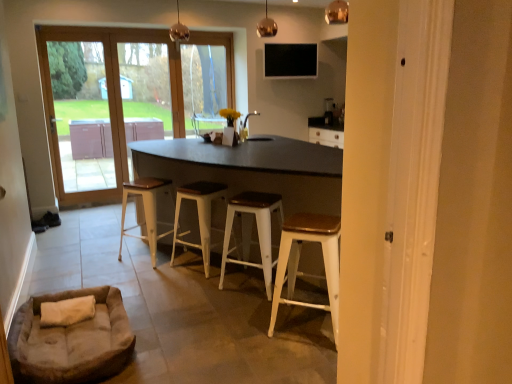
Question: Is wooden seat white metal stool at center, marked as the second stool in a right-to-left arrangement, at the left side of wooden seat white stool at center, the first stool from the left?

Choices:
 (A) yes
 (B) no

Answer: (B)

Question: Does wooden seat white metal stool at center, marked as the third stool in a left-to-right arrangement, have a lesser width compared to wooden seat white stool at center, the 4th stool when ordered from right to left?

Choices:
 (A) no
 (B) yes

Answer: (B)

Question: Does wooden seat white metal stool at center, marked as the third stool in a left-to-right arrangement, have a greater height compared to wooden seat white stool at center, the 4th stool when ordered from right to left?

Choices:
 (A) no
 (B) yes

Answer: (A)

Question: Is wooden seat white metal stool at center, marked as the third stool in a left-to-right arrangement, not inside wooden seat white stool at center, the first stool from the left?

Choices:
 (A) yes
 (B) no

Answer: (A)

Question: Does wooden seat white metal stool at center, marked as the second stool in a right-to-left arrangement, appear on the right side of wooden seat white stool at center, the first stool from the left?

Choices:
 (A) no
 (B) yes

Answer: (B)

Question: Relative to white wood stool at center, the 2th stool in the left-to-right sequence, is wooden door at left in front or behind?

Choices:
 (A) front
 (B) behind

Answer: (B)

Question: In terms of size, does wooden door at left appear bigger or smaller than white wood stool at center, the 2th stool in the left-to-right sequence?

Choices:
 (A) big
 (B) small

Answer: (A)

Question: Considering the positions of wooden door at left and white wood stool at center, positioned as the third stool in right-to-left order, in the image, is wooden door at left wider or thinner than white wood stool at center, positioned as the third stool in right-to-left order,?

Choices:
 (A) thin
 (B) wide

Answer: (A)

Question: Does point (180, 124) appear closer or farther from the camera than point (201, 241)?

Choices:
 (A) farther
 (B) closer

Answer: (A)

Question: From a real-world perspective, is white wood stool at center, the 2th stool in the left-to-right sequence, positioned above or below black matte tv at upper center?

Choices:
 (A) below
 (B) above

Answer: (A)

Question: Relative to black matte tv at upper center, is white wood stool at center, positioned as the third stool in right-to-left order, in front or behind?

Choices:
 (A) front
 (B) behind

Answer: (A)

Question: Is point (205, 180) positioned closer to the camera than point (305, 76)?

Choices:
 (A) farther
 (B) closer

Answer: (B)

Question: Considering the positions of white wood stool at center, positioned as the third stool in right-to-left order, and black matte tv at upper center in the image, is white wood stool at center, positioned as the third stool in right-to-left order, bigger or smaller than black matte tv at upper center?

Choices:
 (A) big
 (B) small

Answer: (A)

Question: From a real-world perspective, is wooden door at left positioned above or below suede beige dog bed at lower left?

Choices:
 (A) below
 (B) above

Answer: (B)

Question: Is point (184, 130) closer or farther from the camera than point (100, 372)?

Choices:
 (A) closer
 (B) farther

Answer: (B)